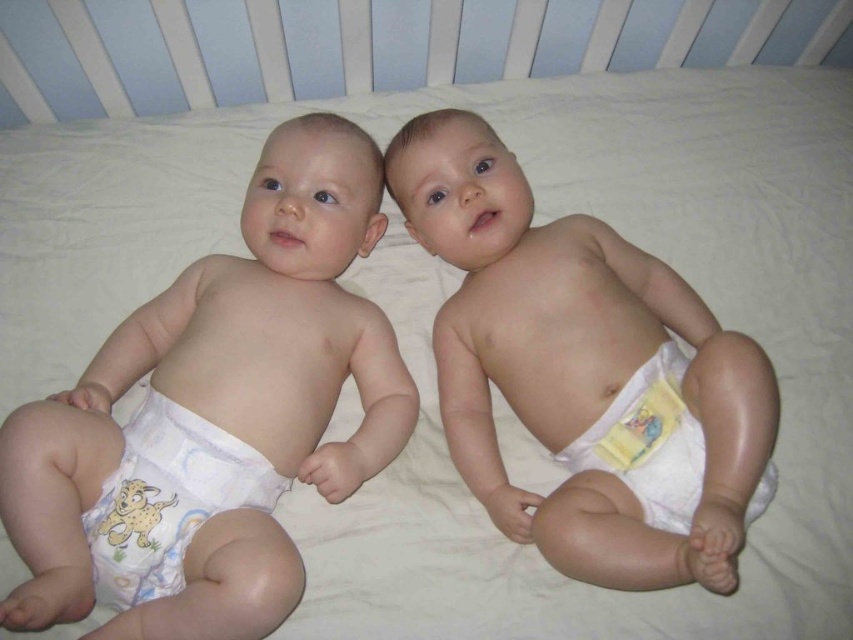
You are a nurse in a nursery. You need to check the diapers of two babies lying on a white mattress in a crib with vertical slats. The babies are positioned close together. You see the white cloth diaper at center and the white printed diaper at lower left. Which diaper is located to the right of the other?

The white cloth diaper at center is positioned on the right side of white printed diaper at lower left.

You are a nurse in a nursery. You need to locate the white cloth diaper at center. Where would you find it in the image?

The white cloth diaper at center is located at the 2D coordinates point (585, 372) in the image.

You are a photographer taking a picture of two babies in a crib. You notice two points marked on the image at coordinates point (x=521, y=340) and point (x=186, y=422). Which point is closer to the camera?

Point (x=521, y=340) is closer to the camera than point (x=186, y=422).